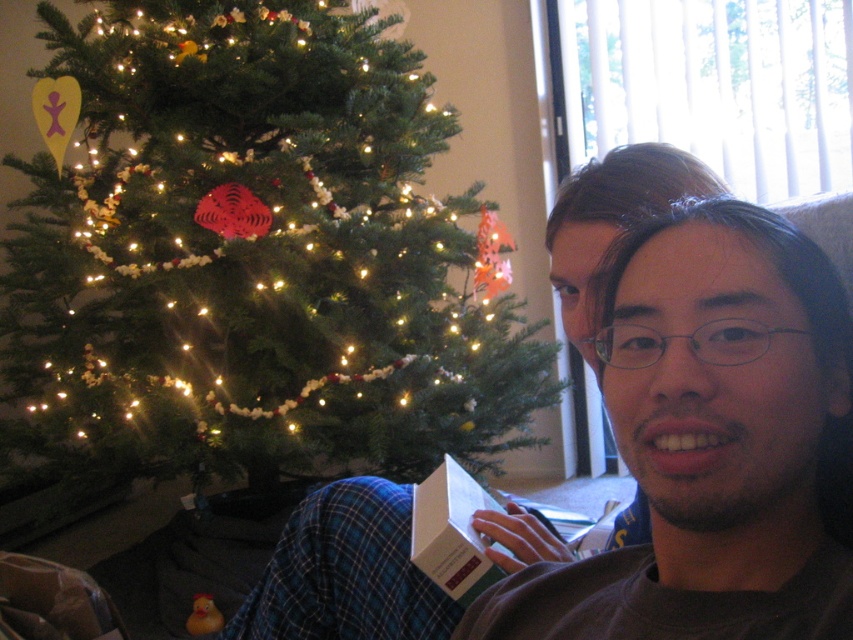
Can you confirm if green matte christmas tree at center is wider than matte brown box at lower center?

Yes, green matte christmas tree at center is wider than matte brown box at lower center.

Looking at this image, which of these two, green matte christmas tree at center or matte brown box at lower center, stands shorter?

With less height is matte brown box at lower center.

At what (x,y) coordinates should I click in order to perform the action: click on green matte christmas tree at center. Please return your answer as a coordinate pair (x, y). The width and height of the screenshot is (853, 640). Looking at the image, I should click on (250, 256).